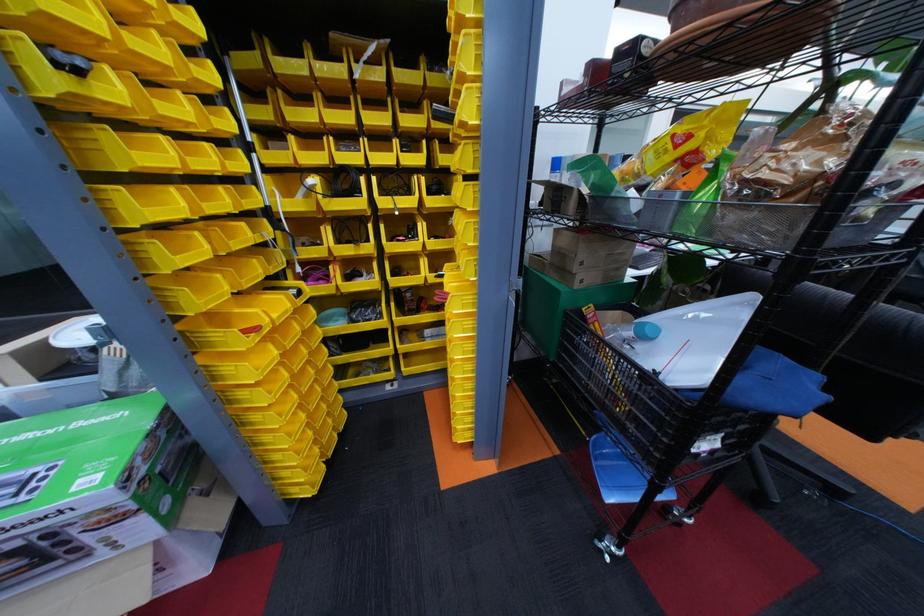
Where is `chair sitting surface`? The height and width of the screenshot is (616, 924). chair sitting surface is located at coordinates (921, 434).